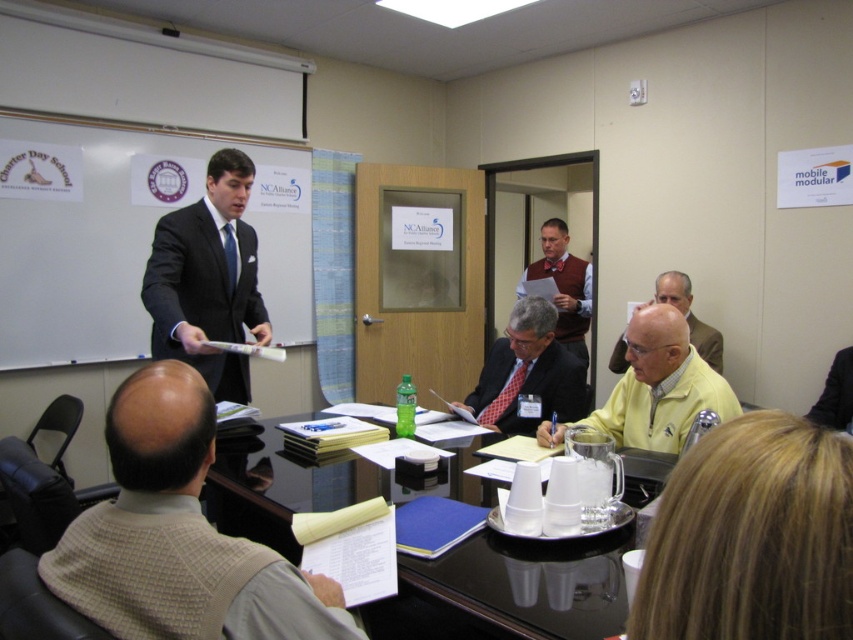
Question: Which object is the farthest from the yellow matte sweater at center?

Choices:
 (A) matte black suit at center
 (B) velvet bow tie at center
 (C) black glossy table at center

Answer: (B)

Question: Among these objects, which one is nearest to the camera?

Choices:
 (A) matte black suit at center
 (B) black glossy table at center
 (C) whiteboard at left
 (D) yellow matte shirt at center

Answer: (B)

Question: Observing the image, what is the correct spatial positioning of black glossy table at center in reference to yellow matte sweater at center?

Choices:
 (A) below
 (B) above

Answer: (A)

Question: From the image, what is the correct spatial relationship of beige checkered vest at lower left in relation to yellow matte sweater at center?

Choices:
 (A) above
 (B) below

Answer: (B)

Question: Is beige checkered vest at lower left above velvet bow tie at center?

Choices:
 (A) no
 (B) yes

Answer: (A)

Question: Which object is positioned farthest from the yellow matte sweater at center?

Choices:
 (A) whiteboard at left
 (B) velvet bow tie at center
 (C) matte black suit at center

Answer: (A)